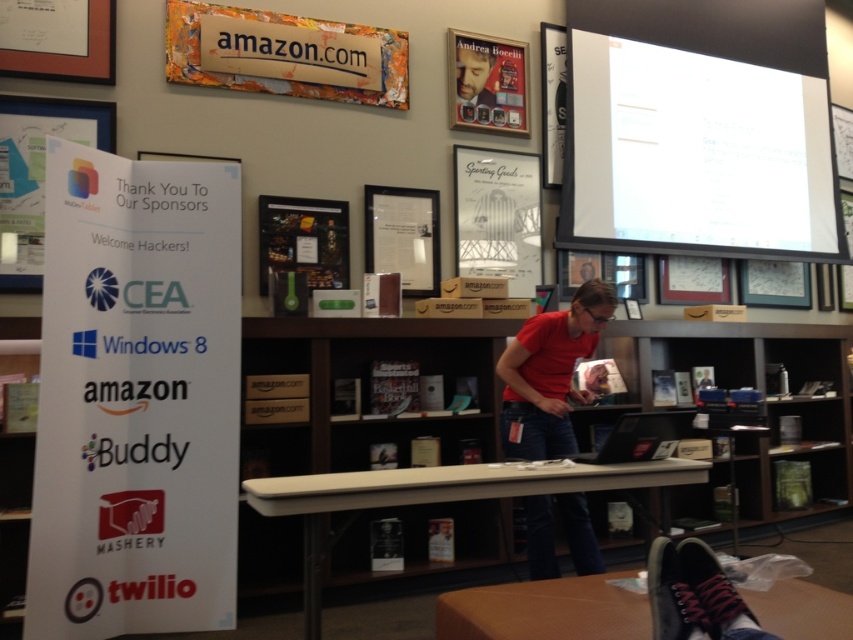
You are a participant at the event and need to access the laptop on the beige plastic table at center. The brown wood table at lower center is blocking your path. Can you walk around it to reach the laptop?

The brown wood table at lower center is behind the beige plastic table at center, so you can walk around the beige plastic table at center to access the laptop without obstruction from the brown wood table at lower center.

You are organizing a presentation and need to decide which item to place on the main table. The white paper at left and the metallic gold poster at upper center are available. Which one has a greater width and would take up more space on the table?

The white paper at left has a greater width than the metallic gold poster at upper center, so it would take up more space on the table.

You are a visitor at this event and want to reach the brown wood table at lower center to interact with the laptop. However, there is a painted wood sign at upper center blocking your path. Can you walk around the sign to get to the table?

The painted wood sign at upper center is further to the viewer than the brown wood table at lower center, so the sign is closer to you. This means you can walk around the sign to reach the brown wood table at lower center.